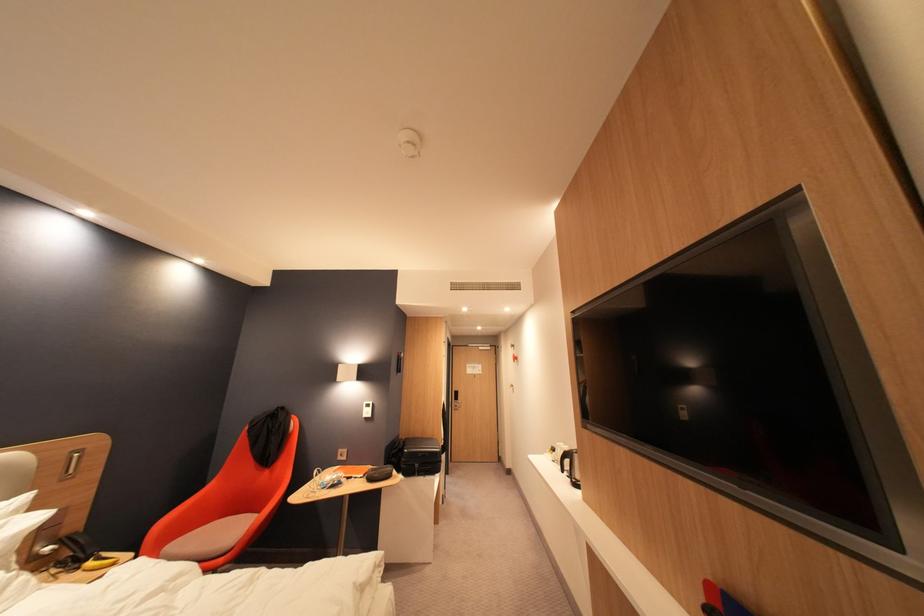
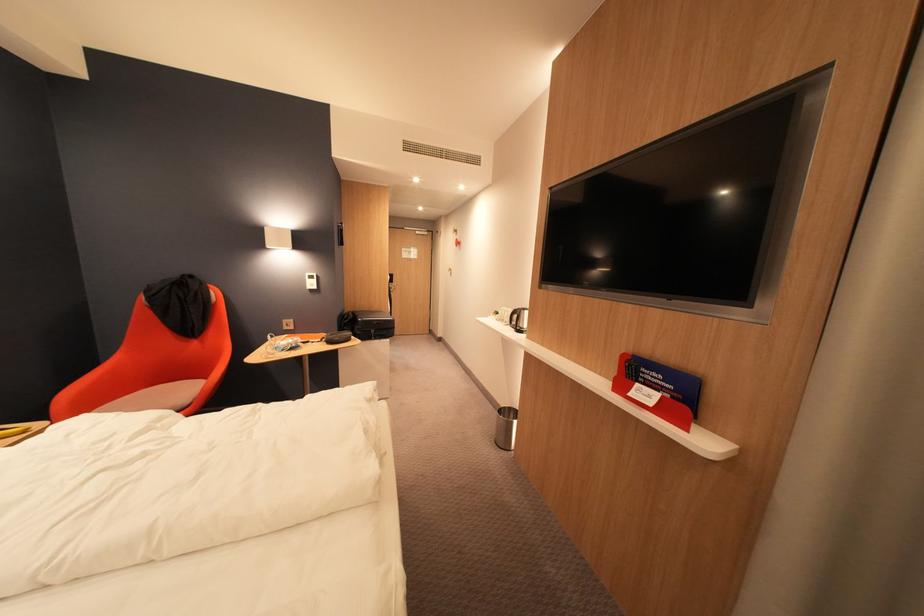
The images are taken continuously from a first-person perspective. In which direction is your viewpoint rotating?

The camera rotated toward right-down.